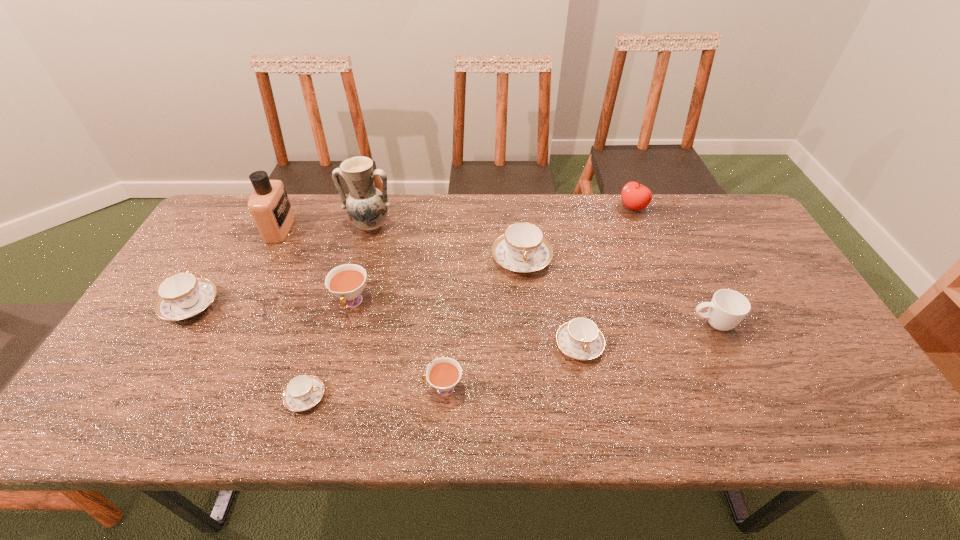
Image resolution: width=960 pixels, height=540 pixels. I want to click on the leftmost teacup, so click(x=181, y=296).

The image size is (960, 540). I want to click on the sixth object from left to right, so click(444, 374).

This screenshot has width=960, height=540. In order to click on the nearer white teacup in this screenshot , I will do `click(444, 374)`.

Find the location of a particular element. The height and width of the screenshot is (540, 960). the third biggest blue teacup is located at coordinates (580, 338).

Find the location of a particular element. the second blue teacup from left to right is located at coordinates (303, 392).

This screenshot has height=540, width=960. Identify the location of the nearest blue teacup. (303, 392).

Where is `vacant region located 0.100m on either side of the pottery`? The width and height of the screenshot is (960, 540). vacant region located 0.100m on either side of the pottery is located at coordinates (361, 261).

Where is `vacant space located 0.250m on the front label of the beige perfume`? The width and height of the screenshot is (960, 540). vacant space located 0.250m on the front label of the beige perfume is located at coordinates (370, 228).

The image size is (960, 540). I want to click on vacant space located 0.160m on the right of the red apple, so click(694, 207).

The width and height of the screenshot is (960, 540). What are the coordinates of `free space located on the side with the handle of the farthest teacup` in the screenshot? It's located at (535, 399).